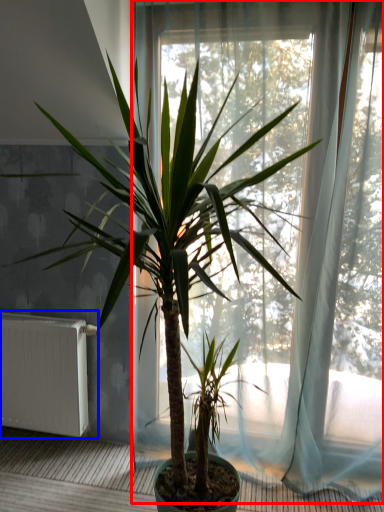
Question: Which point is closer to the camera, window (highlighted by a red box) or radiator (highlighted by a blue box)?

Choices:
 (A) window
 (B) radiator

Answer: (A)